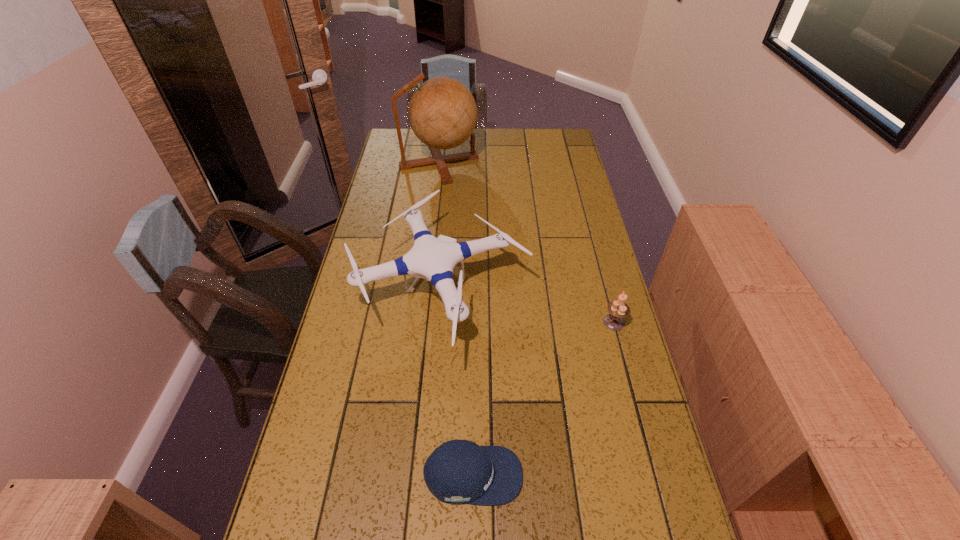
What are the coordinates of `globe` in the screenshot? It's located at (442, 111).

Locate an element on the screen. the farthest object is located at coordinates (442, 111).

Locate an element on the screen. Image resolution: width=960 pixels, height=540 pixels. the third shortest object is located at coordinates click(x=431, y=258).

This screenshot has height=540, width=960. What are the coordinates of `the rightmost object` in the screenshot? It's located at (618, 309).

The image size is (960, 540). Identify the location of the third tallest object. (618, 309).

The width and height of the screenshot is (960, 540). What are the coordinates of `the shortest object` in the screenshot? It's located at [x=458, y=471].

Identify the location of the nearest object. The height and width of the screenshot is (540, 960). (458, 471).

The width and height of the screenshot is (960, 540). I want to click on vacant region located 0.180m on the surface of the tallest object, so click(x=520, y=163).

At what (x,y) coordinates should I click in order to perform the action: click on vacant space located on the right of the drone. Please return your answer as a coordinate pair (x, y). This screenshot has height=540, width=960. Looking at the image, I should click on (592, 292).

At what (x,y) coordinates should I click in order to perform the action: click on vacant region located on the back of the candle holder. Please return your answer as a coordinate pair (x, y). Looking at the image, I should click on (592, 239).